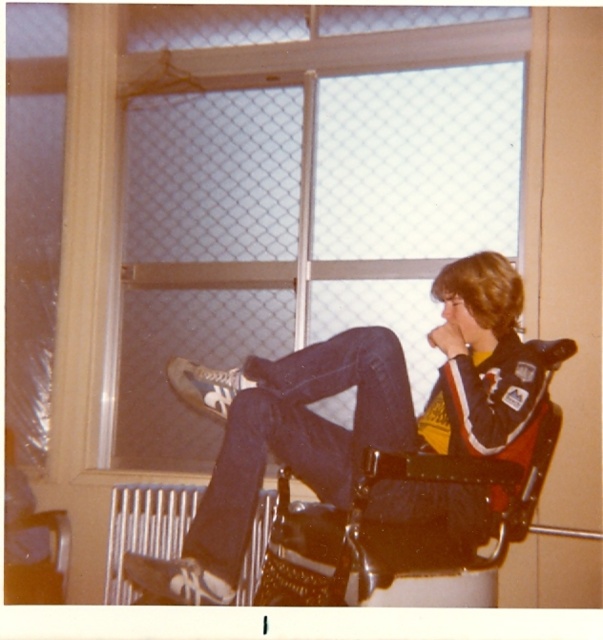
Question: Which point is farther to the camera?

Choices:
 (A) 482,225
 (B) 353,477

Answer: (A)

Question: Which object is positioned farthest from the clear glass window at upper center?

Choices:
 (A) denim jeans at center
 (B) dark blue denim jeans at center

Answer: (B)

Question: Which is farther from the dark blue denim jeans at center?

Choices:
 (A) denim jeans at center
 (B) clear glass window at upper center

Answer: (B)

Question: Can you confirm if clear glass window at upper center is positioned below denim jeans at center?

Choices:
 (A) yes
 (B) no

Answer: (B)

Question: Is the position of denim jeans at center less distant than that of dark blue denim jeans at center?

Choices:
 (A) yes
 (B) no

Answer: (B)

Question: Considering the relative positions of denim jeans at center and dark blue denim jeans at center in the image provided, where is denim jeans at center located with respect to dark blue denim jeans at center?

Choices:
 (A) above
 (B) below

Answer: (A)